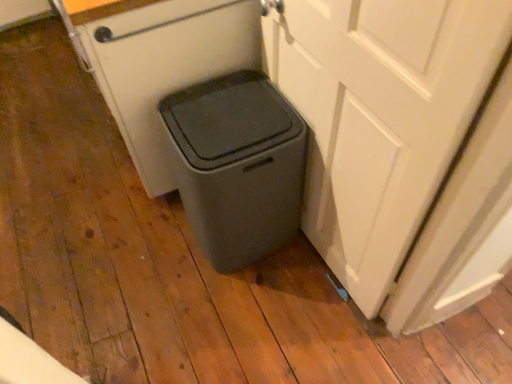
What do you see at coordinates (380, 117) in the screenshot?
I see `white matte door at right` at bounding box center [380, 117].

The image size is (512, 384). In order to click on white matte door at right in this screenshot , I will do pos(380,117).

Locate an element on the screen. matte gray trash can at lower center is located at coordinates (237, 165).

The height and width of the screenshot is (384, 512). Describe the element at coordinates (237, 165) in the screenshot. I see `matte gray trash can at lower center` at that location.

In order to face matte gray trash can at lower center, should I rotate leftwards or rightwards?

You should look left and rotate roughly 3.142 degrees.

Where is `white matte door at right`? The image size is (512, 384). white matte door at right is located at coordinates pos(380,117).

Which object is positioned more to the left, matte gray trash can at lower center or white matte door at right?

matte gray trash can at lower center.

Based on the photo, is matte gray trash can at lower center positioned behind white matte door at right?

Yes, matte gray trash can at lower center is further from the viewer.

Considering the points (213, 139) and (378, 257), which point is in front, point (213, 139) or point (378, 257)?

The point (378, 257) is more forward.

From the image's perspective, does matte gray trash can at lower center appear higher than white matte door at right?

No.

From a real-world perspective, is matte gray trash can at lower center physically above white matte door at right?

No, from a real-world perspective, matte gray trash can at lower center is not on top of white matte door at right.

Between matte gray trash can at lower center and white matte door at right, which one has smaller width?

With smaller width is white matte door at right.

Considering the sizes of objects matte gray trash can at lower center and white matte door at right in the image provided, who is taller, matte gray trash can at lower center or white matte door at right?

white matte door at right is taller.

Looking at this image, between matte gray trash can at lower center and white matte door at right, which one has larger size?

matte gray trash can at lower center is bigger.

Can white matte door at right be found inside matte gray trash can at lower center?

No.

Are matte gray trash can at lower center and white matte door at right making contact?

There is a gap between matte gray trash can at lower center and white matte door at right.

Is matte gray trash can at lower center looking in the opposite direction of white matte door at right?

A: Yes, matte gray trash can at lower center is facing away from white matte door at right.

Locate an element on the screen. screen door located above the matte gray trash can at lower center (from a real-world perspective) is located at coordinates (380, 117).

Which is more to the left, white matte door at right or matte gray trash can at lower center?

matte gray trash can at lower center.

Between white matte door at right and matte gray trash can at lower center, which one is positioned behind?

matte gray trash can at lower center.

Which point is more distant from viewer, (x=387, y=64) or (x=196, y=127)?

The point (x=196, y=127) is more distant.

Consider the image. From the image's perspective, which is above, white matte door at right or matte gray trash can at lower center?

white matte door at right is shown above in the image.

From a real-world perspective, is white matte door at right physically located above or below matte gray trash can at lower center?

white matte door at right is situated higher than matte gray trash can at lower center in the real world.

Does white matte door at right have a lesser width compared to matte gray trash can at lower center?

Yes, white matte door at right is thinner than matte gray trash can at lower center.

Which of these two, white matte door at right or matte gray trash can at lower center, stands taller?

Standing taller between the two is white matte door at right.

Based on their sizes in the image, would you say white matte door at right is bigger or smaller than matte gray trash can at lower center?

Considering their sizes, white matte door at right takes up less space than matte gray trash can at lower center.

Is white matte door at right spatially inside matte gray trash can at lower center, or outside of it?

The correct answer is: outside.

Is white matte door at right not near matte gray trash can at lower center?

No, white matte door at right is not far from matte gray trash can at lower center.

Consider the image. Is white matte door at right facing away from matte gray trash can at lower center?

Yes, matte gray trash can at lower center is at the back of white matte door at right.

Measure the distance between white matte door at right and matte gray trash can at lower center.

white matte door at right and matte gray trash can at lower center are 28.11 centimeters apart.

The image size is (512, 384). Identify the location of screen door above the matte gray trash can at lower center (from the image's perspective). tap(380, 117).

In the image, there is a white matte door at right. Find the location of `waste container below it (from the image's perspective)`. waste container below it (from the image's perspective) is located at coordinates (237, 165).

Find the location of `waste container to the left of white matte door at right`. waste container to the left of white matte door at right is located at coordinates (237, 165).